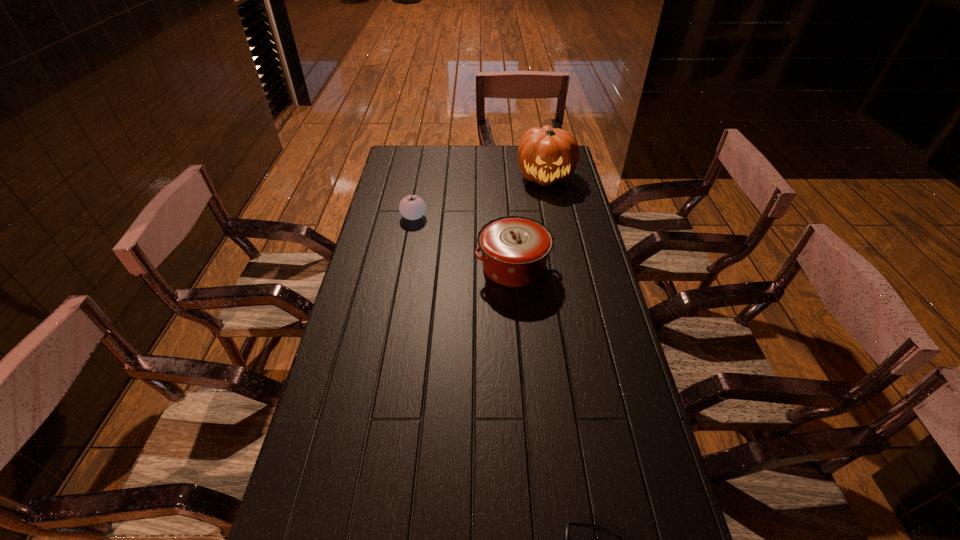
At what (x,y) coordinates should I click in order to perform the action: click on object present at the left edge. Please return your answer as a coordinate pair (x, y). Looking at the image, I should click on (412, 207).

The image size is (960, 540). I want to click on pumpkin located in the right edge section of the desktop, so click(546, 155).

This screenshot has height=540, width=960. Find the location of `casserole at the right edge`. casserole at the right edge is located at coordinates (514, 249).

Find the location of a particular element. The image size is (960, 540). object at the far right corner is located at coordinates (546, 155).

You are a GUI agent. You are given a task and a screenshot of the screen. Output one action in this format:
    pyautogui.click(x=<x>, y=<y>)
    Task: Click on the free space at the far edge of the desktop
    The width and height of the screenshot is (960, 540).
    Given the screenshot: What is the action you would take?
    pyautogui.click(x=437, y=158)

Locate an element on the screen. vacant space at the left edge is located at coordinates (344, 352).

Image resolution: width=960 pixels, height=540 pixels. Find the location of `vacant area at the right edge`. vacant area at the right edge is located at coordinates (553, 249).

I want to click on free space at the far left corner, so click(x=425, y=150).

Image resolution: width=960 pixels, height=540 pixels. Find the location of `free space that is in between the tallest object and the leftmost object`. free space that is in between the tallest object and the leftmost object is located at coordinates (480, 197).

This screenshot has height=540, width=960. In order to click on empty space between the leftmost object and the tallest object in this screenshot , I will do `click(480, 197)`.